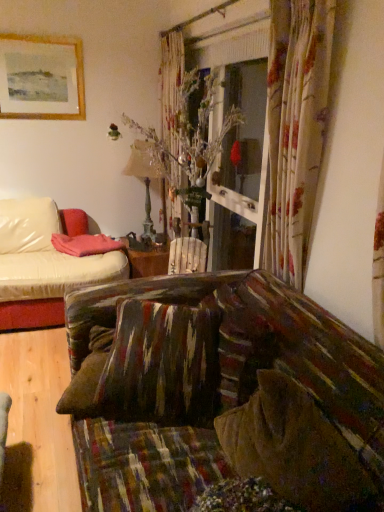
Question: Is textured brown pillow at center situated inside gold-framed painting at upper left or outside?

Choices:
 (A) inside
 (B) outside

Answer: (B)

Question: In terms of width, does textured brown pillow at center look wider or thinner when compared to gold-framed painting at upper left?

Choices:
 (A) thin
 (B) wide

Answer: (B)

Question: From the image's perspective, is textured brown pillow at center positioned above or below gold-framed painting at upper left?

Choices:
 (A) below
 (B) above

Answer: (A)

Question: In terms of height, does gold-framed painting at upper left look taller or shorter compared to textured brown pillow at center?

Choices:
 (A) short
 (B) tall

Answer: (A)

Question: Is gold-framed painting at upper left inside or outside of textured brown pillow at center?

Choices:
 (A) outside
 (B) inside

Answer: (A)

Question: Considering their positions, is gold-framed painting at upper left located in front of or behind textured brown pillow at center?

Choices:
 (A) behind
 (B) front

Answer: (A)

Question: From a real-world perspective, is gold-framed painting at upper left above or below textured brown pillow at center?

Choices:
 (A) below
 (B) above

Answer: (B)